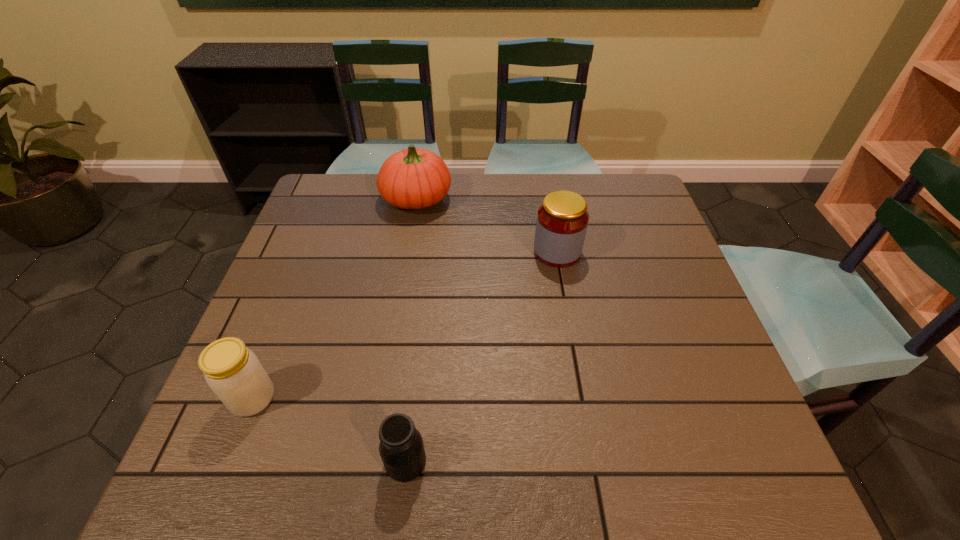
This screenshot has width=960, height=540. I want to click on blank region between the second farthest jar and the second jar from right to left, so click(329, 430).

Identify the location of unoccupied area between the leftmost jar and the second jar from left to right. click(x=329, y=430).

Locate an element on the screen. This screenshot has height=540, width=960. empty space that is in between the pumpkin and the rightmost object is located at coordinates (487, 225).

Where is `free space between the shortest jar and the pumpkin`? This screenshot has height=540, width=960. free space between the shortest jar and the pumpkin is located at coordinates (411, 330).

The height and width of the screenshot is (540, 960). Identify the location of blank region between the farthest jar and the second nearest object. (405, 325).

Locate an element on the screen. vacant point located between the rightmost object and the second jar from right to left is located at coordinates (481, 357).

Where is `vacant area between the second nearest jar and the nearest jar`? This screenshot has height=540, width=960. vacant area between the second nearest jar and the nearest jar is located at coordinates (329, 430).

Find the location of a particular element. vacant region between the nearest jar and the leftmost jar is located at coordinates (329, 430).

Where is `free space between the farthest object and the shortest object`? This screenshot has width=960, height=540. free space between the farthest object and the shortest object is located at coordinates (411, 330).

At what (x,y) coordinates should I click in order to perform the action: click on the closest object to the leftmost jar. Please return your answer as a coordinate pair (x, y). This screenshot has height=540, width=960. Looking at the image, I should click on (401, 448).